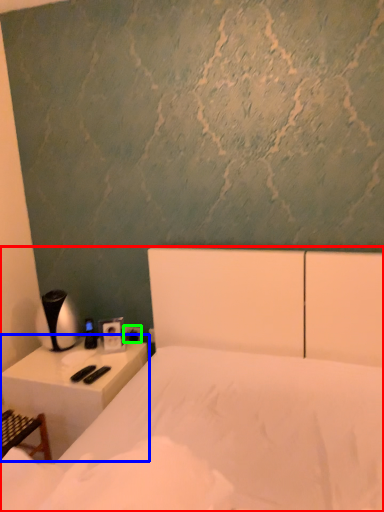
Question: Based on their relative distances, which object is farther from bed (highlighted by a red box)? Choose from nightstand (highlighted by a blue box) and electric outlet (highlighted by a green box).

Choices:
 (A) nightstand
 (B) electric outlet

Answer: (B)